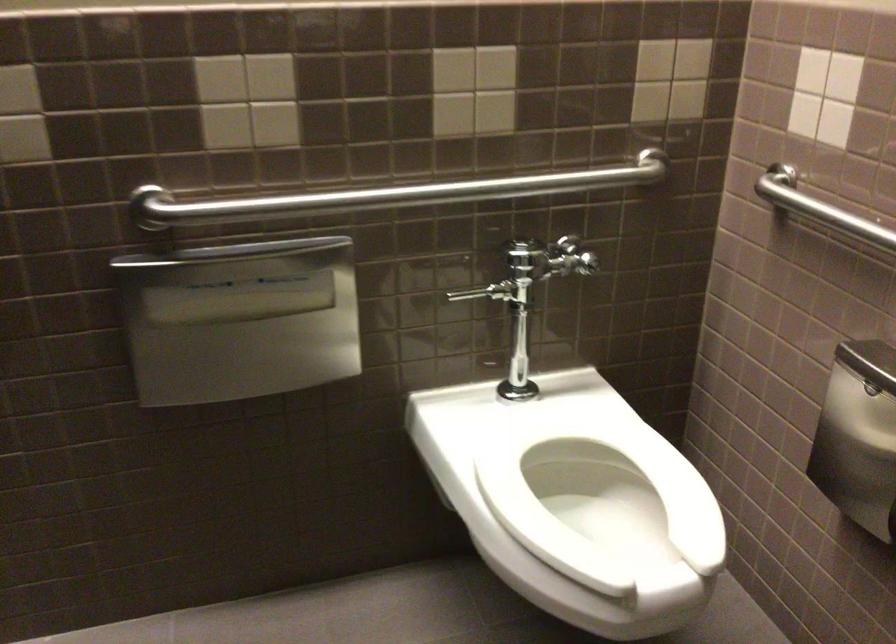
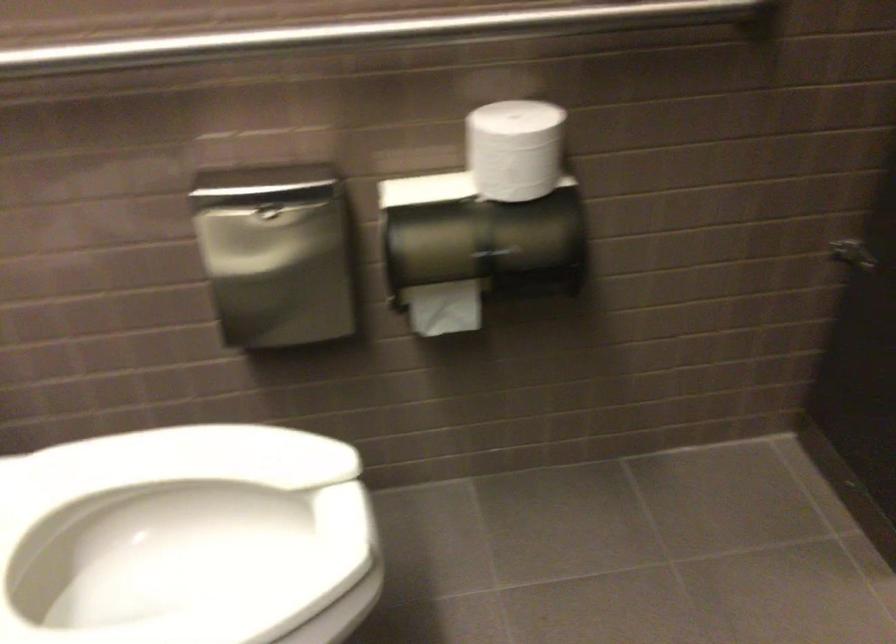
The point at (642, 535) is marked in the first image. Where is the corresponding point in the second image?

(186, 538)